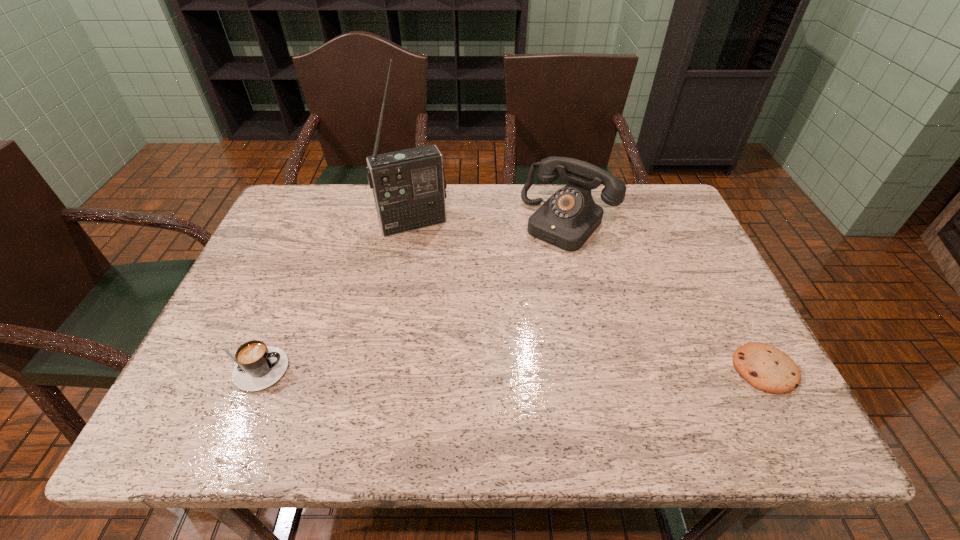
Where is `object that is the third nearest to the rightmost object`? This screenshot has width=960, height=540. object that is the third nearest to the rightmost object is located at coordinates (258, 366).

Image resolution: width=960 pixels, height=540 pixels. Find the location of `vacant point that satisfies the following two spatial constraints: 1. on the back side of the telephone; 2. on the right side of the second object from left to right`. vacant point that satisfies the following two spatial constraints: 1. on the back side of the telephone; 2. on the right side of the second object from left to right is located at coordinates (414, 222).

Where is `vacant region that satisfies the following two spatial constraints: 1. on the back side of the third object from right to left; 2. on the left side of the second tallest object`? This screenshot has width=960, height=540. vacant region that satisfies the following two spatial constraints: 1. on the back side of the third object from right to left; 2. on the left side of the second tallest object is located at coordinates (414, 222).